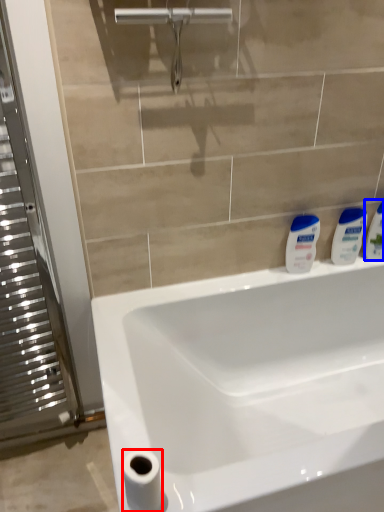
Question: Which object appears farthest to the camera in this image, toilet paper (highlighted by a red box) or toiletry (highlighted by a blue box)?

Choices:
 (A) toilet paper
 (B) toiletry

Answer: (B)